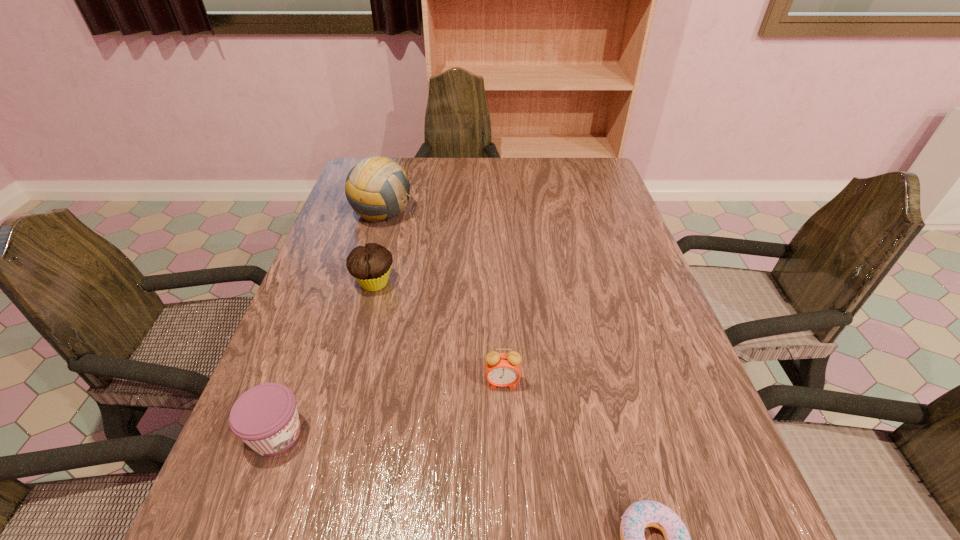
Where is `vacant space located 0.120m on the front label of the jam`? This screenshot has height=540, width=960. vacant space located 0.120m on the front label of the jam is located at coordinates (373, 434).

In order to click on volleyball positioned at the left edge in this screenshot , I will do `click(377, 188)`.

Where is `muffin situated at the left edge`? This screenshot has width=960, height=540. muffin situated at the left edge is located at coordinates (370, 265).

Where is `jam that is at the left edge`? jam that is at the left edge is located at coordinates (265, 417).

Where is `free space at the far edge of the desktop`? free space at the far edge of the desktop is located at coordinates (490, 191).

Where is `vacant region at the left edge`? The width and height of the screenshot is (960, 540). vacant region at the left edge is located at coordinates (348, 276).

Image resolution: width=960 pixels, height=540 pixels. Identify the location of vacant space at the right edge. (587, 218).

This screenshot has width=960, height=540. In the image, there is a desktop. In order to click on free space at the far right corner in this screenshot , I will do `click(560, 163)`.

You are a GUI agent. You are given a task and a screenshot of the screen. Output one action in this format:
    pyautogui.click(x=<x>, y=<y>)
    Task: Click on the free point between the fourth object from left to right and the second nearest object
    This screenshot has width=960, height=540.
    Given the screenshot: What is the action you would take?
    pyautogui.click(x=390, y=408)

This screenshot has height=540, width=960. What are the coordinates of `free space between the alarm clock and the jam` in the screenshot? It's located at (390, 408).